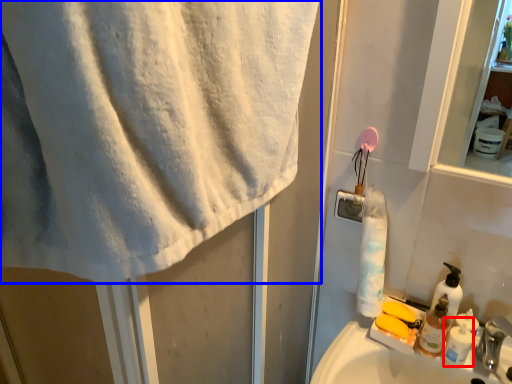
Question: Which object appears closest to the camera in this image, shaving cream (highlighted by a red box) or towel (highlighted by a blue box)?

Choices:
 (A) shaving cream
 (B) towel

Answer: (B)